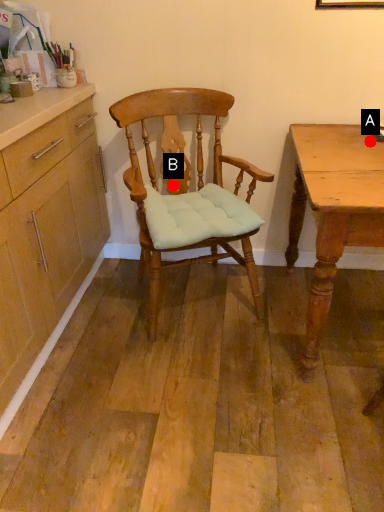
Question: Two points are circled on the image, labeled by A and B beside each circle. Among these points, which one is nearest to the camera?

Choices:
 (A) A is closer
 (B) B is closer

Answer: (A)